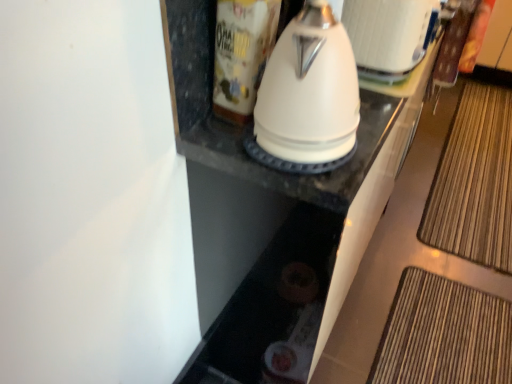
You are a GUI agent. You are given a task and a screenshot of the screen. Output one action in this format:
    pyautogui.click(x=<x>, y=<y>)
    Task: Click on the vacant space in front of white glossy canister at upper center
    
    Given the screenshot: What is the action you would take?
    pyautogui.click(x=248, y=145)